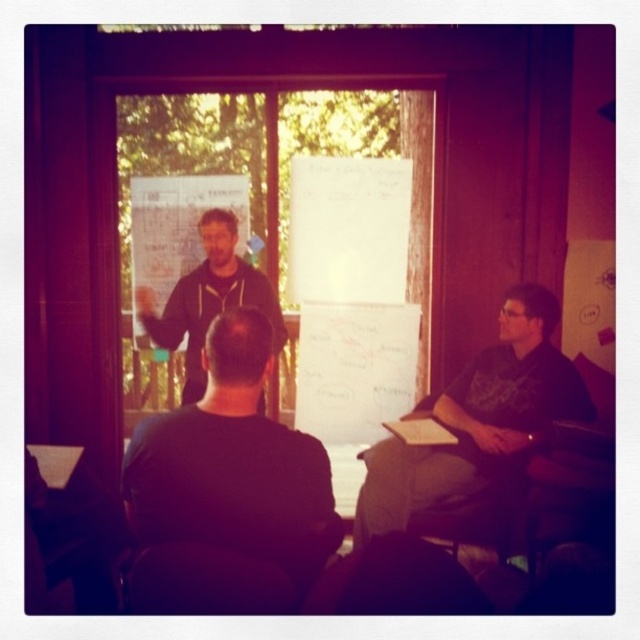
You are organizing a photoshoot and need to ensure that all clothing items in the scene are correctly sized for the models. Given the black matte shirt at center and the matte black hoodie at center, which clothing item would you adjust to ensure proper fit?

The black matte shirt at center is smaller than the matte black hoodie at center, so you should adjust the black matte shirt at center to ensure it fits properly.

From the picture: You are organizing a photo shoot and need to arrange two models wearing the black matte shirt at center and the dark gray shirt at right. The photographer wants the thinner model to stand closer to the camera. Which shirt should be placed nearer to the camera?

The black matte shirt at center is thinner than the dark gray shirt at right, so the model wearing the black matte shirt at center should be placed nearer to the camera.

Consider the image. You are standing in the room and want to greet the person wearing the dark gray shirt at right. Based on their position relative to the whiteboards, where should you walk to find them?

The dark gray shirt at right is located at point (x=477, y=433), which places them near the right side of the room, likely between the two whiteboards or to the right of them. Walk towards the right side of the whiteboards to find them.